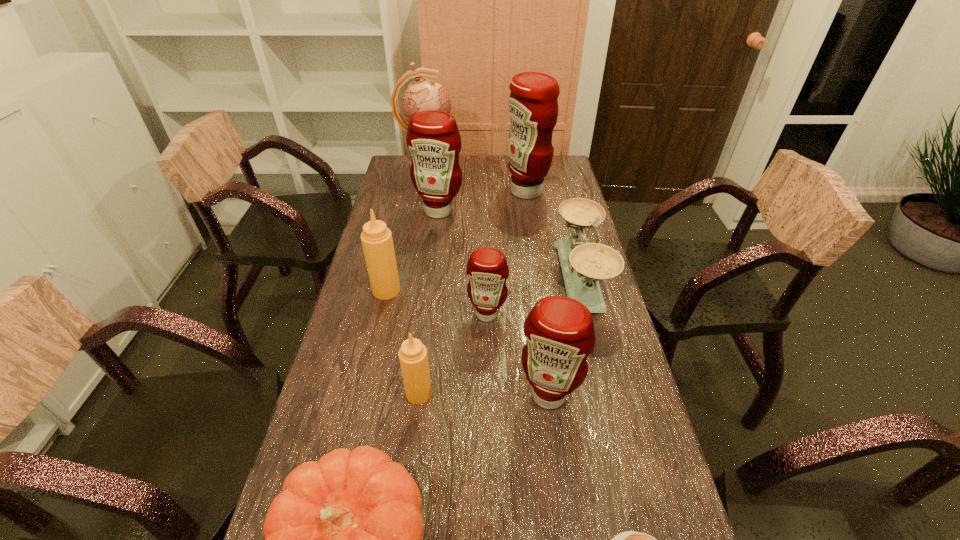
This screenshot has width=960, height=540. I want to click on the nearer tan condiment, so click(413, 357).

At what (x,y) coordinates should I click in order to perform the action: click on the sixth object from left to right. Please return your answer as a coordinate pair (x, y). The width and height of the screenshot is (960, 540). Looking at the image, I should click on (487, 268).

The image size is (960, 540). Find the location of `the fourth condiment from left to right`. the fourth condiment from left to right is located at coordinates (487, 268).

You are a GUI agent. You are given a task and a screenshot of the screen. Output one action in this format:
    pyautogui.click(x=<x>, y=<y>)
    Task: Click on the free space located 0.050m on the left of the tallest condiment
    This screenshot has height=540, width=960.
    Given the screenshot: What is the action you would take?
    pyautogui.click(x=492, y=191)

In order to click on vacant area located 0.340m on the front-facing side of the farthest object in this screenshot , I will do `click(533, 167)`.

The width and height of the screenshot is (960, 540). In order to click on free space located on the back of the third smallest red condiment in this screenshot , I will do `click(443, 182)`.

Identify the location of vacant area situated 0.320m on the front of the left tan condiment. click(364, 389).

The height and width of the screenshot is (540, 960). In order to click on vacant space positioned on the left of the nearest red condiment in this screenshot , I will do `click(367, 395)`.

The height and width of the screenshot is (540, 960). What are the coordinates of `free space located on the front-facing side of the scale` in the screenshot? It's located at (541, 278).

Where is `vacant region located 0.230m on the front-facing side of the scale`? The width and height of the screenshot is (960, 540). vacant region located 0.230m on the front-facing side of the scale is located at coordinates (x=486, y=278).